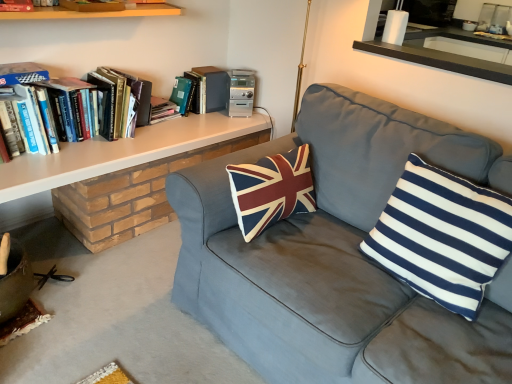
Question: Which direction should I rotate to look at hardcover book at upper center, the 4th book positioned from the front?

Choices:
 (A) right
 (B) left

Answer: (B)

Question: Considering the relative sizes of hardcover books at left, the third book when ordered from back to front, and hardcover book at upper center, the 4th book positioned from the front, in the image provided, is hardcover books at left, the third book when ordered from back to front, taller than hardcover book at upper center, the 4th book positioned from the front,?

Choices:
 (A) yes
 (B) no

Answer: (A)

Question: Considering the relative sizes of hardcover books at left, the third book when ordered from back to front, and hardcover book at upper center, the 4th book positioned from the front, in the image provided, is hardcover books at left, the third book when ordered from back to front, bigger than hardcover book at upper center, the 4th book positioned from the front,?

Choices:
 (A) no
 (B) yes

Answer: (B)

Question: Is hardcover books at left, the third book when ordered from back to front, facing away from hardcover book at upper center, the 4th book positioned from the front?

Choices:
 (A) yes
 (B) no

Answer: (B)

Question: From the image's perspective, is hardcover books at left, the third book when ordered from back to front, below hardcover book at upper center, the 4th book positioned from the front?

Choices:
 (A) no
 (B) yes

Answer: (B)

Question: Does hardcover books at left, the third book when ordered from back to front, have a lesser width compared to hardcover book at upper center, the 4th book positioned from the front?

Choices:
 (A) yes
 (B) no

Answer: (B)

Question: Could you tell me if hardcover books at left, marked as the 2th book in a front-to-back arrangement, is facing hardcover book at upper center, acting as the first book starting from the back?

Choices:
 (A) yes
 (B) no

Answer: (B)

Question: Is white/blue striped pillow at right outside of hardcover book at upper left, the third book viewed from the front?

Choices:
 (A) yes
 (B) no

Answer: (A)

Question: Are white/blue striped pillow at right and hardcover book at upper left, which ranks as the second book in back-to-front order, located far from each other?

Choices:
 (A) yes
 (B) no

Answer: (A)

Question: From a real-world perspective, is white/blue striped pillow at right over hardcover book at upper left, the third book viewed from the front?

Choices:
 (A) no
 (B) yes

Answer: (B)

Question: Is white/blue striped pillow at right with hardcover book at upper left, which ranks as the second book in back-to-front order?

Choices:
 (A) no
 (B) yes

Answer: (A)

Question: Considering the relative sizes of white/blue striped pillow at right and hardcover book at upper left, which ranks as the second book in back-to-front order, in the image provided, is white/blue striped pillow at right smaller than hardcover book at upper left, which ranks as the second book in back-to-front order,?

Choices:
 (A) yes
 (B) no

Answer: (B)

Question: Can you confirm if white/blue striped pillow at right is shorter than hardcover book at upper left, which ranks as the second book in back-to-front order?

Choices:
 (A) yes
 (B) no

Answer: (B)

Question: Considering the relative sizes of white/blue striped pillow at right and hardcover books at left, marked as the 2th book in a front-to-back arrangement, in the image provided, is white/blue striped pillow at right wider than hardcover books at left, marked as the 2th book in a front-to-back arrangement,?

Choices:
 (A) yes
 (B) no

Answer: (B)